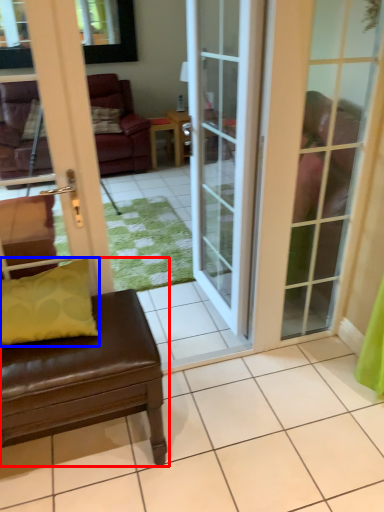
Question: Which object is closer to the camera taking this photo, studio couch (highlighted by a red box) or pillow (highlighted by a blue box)?

Choices:
 (A) studio couch
 (B) pillow

Answer: (A)